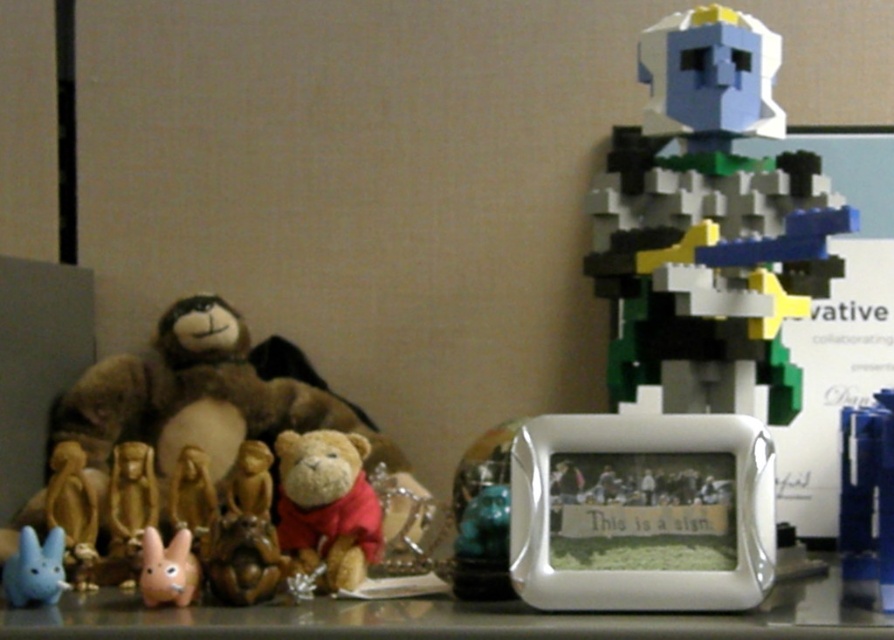
You are organizing items on a desk and need to place the multicolored plastic toy at upper right and the blue plastic pen at right. Which item is located higher up?

The multicolored plastic toy at upper right is positioned over the blue plastic pen at right, so it is higher up.

You are organizing a shelf and need to know which object takes up more vertical space. Based on the image, which is taller between the gold metallic statue at lower left and the matte blue plush rabbit at lower left?

The gold metallic statue at lower left is much taller than the matte blue plush rabbit at lower left, so it takes up more vertical space.

You are standing 3 feet away from the desk. Can you reach the multicolored plastic toy at upper right without moving your feet?

The multicolored plastic toy at upper right is 33.48 inches away from camera. Since 3 feet is equal to 36 inches, you are 36 inches away from the desk. Therefore, the toy is closer to you than your standing position, so you can reach it without moving your feet.